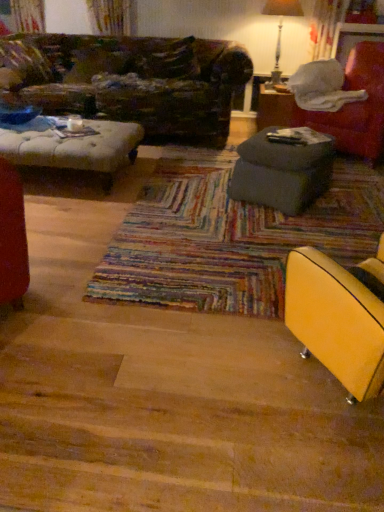
Find the location of `yellow leather chair at lower right, the 1th chair positioned from the front`. yellow leather chair at lower right, the 1th chair positioned from the front is located at coordinates (336, 321).

What do you see at coordinates (336, 321) in the screenshot? Image resolution: width=384 pixels, height=512 pixels. I see `yellow leather chair at lower right, the 2th chair positioned from the right` at bounding box center [336, 321].

The image size is (384, 512). Describe the element at coordinates (277, 108) in the screenshot. I see `matte gray ottoman at center, the 1th table when ordered from top to bottom` at that location.

What is the approximate height of metallic silver table lamp at upper right?

29.69 inches.

You are a GUI agent. You are given a task and a screenshot of the screen. Output one action in this format:
    pyautogui.click(x=<x>, y=<y>)
    Task: Click on the yellow leather chair at lower right, which ranks as the 1th chair in left-to-right order
    Image resolution: width=384 pixels, height=512 pixels.
    Given the screenshot: What is the action you would take?
    pyautogui.click(x=336, y=321)

Consider the image. Is gray fabric ottoman at right, positioned as the second table in top-to-bottom order, not within yellow leather chair at lower right, the 2th chair from the top?

Yes, gray fabric ottoman at right, positioned as the second table in top-to-bottom order, is not within yellow leather chair at lower right, the 2th chair from the top.

From their relative heights in the image, would you say gray fabric ottoman at right, which is the first table in front-to-back order, is taller or shorter than yellow leather chair at lower right, the 2th chair from the top?

gray fabric ottoman at right, which is the first table in front-to-back order, is shorter than yellow leather chair at lower right, the 2th chair from the top.

Can you confirm if gray fabric ottoman at right, which is the second table in back-to-front order, is positioned to the left of yellow leather chair at lower right, which ranks as the 1th chair in left-to-right order?

Yes.

Can you tell me how much metallic silver table lamp at upper right and gray fabric ottoman at right, which is the first table in front-to-back order, differ in facing direction?

118 degrees separate the facing orientations of metallic silver table lamp at upper right and gray fabric ottoman at right, which is the first table in front-to-back order.

From the image's perspective, between metallic silver table lamp at upper right and gray fabric ottoman at right, positioned as the second table in top-to-bottom order, who is located below?

gray fabric ottoman at right, positioned as the second table in top-to-bottom order, is shown below in the image.

Could you tell me if metallic silver table lamp at upper right is facing gray fabric ottoman at right, which is the first table in front-to-back order?

Yes, metallic silver table lamp at upper right faces towards gray fabric ottoman at right, which is the first table in front-to-back order.

Would you say metallic silver table lamp at upper right is inside or outside gray fabric ottoman at right, which is the first table in front-to-back order?

metallic silver table lamp at upper right lies outside gray fabric ottoman at right, which is the first table in front-to-back order.

Which object is wider, matte gray ottoman at center, the 1th table when ordered from top to bottom, or velvet red armchair at right, which is counted as the 2th chair, starting from the front?

Wider between the two is velvet red armchair at right, which is counted as the 2th chair, starting from the front.

Would you say matte gray ottoman at center, which ranks as the first table in back-to-front order, is inside or outside velvet red armchair at right, acting as the 1th chair starting from the back?

matte gray ottoman at center, which ranks as the first table in back-to-front order, is not inside velvet red armchair at right, acting as the 1th chair starting from the back, it's outside.

Would you consider matte gray ottoman at center, the 2th table from the bottom, to be distant from velvet red armchair at right, placed as the 1th chair when sorted from right to left?

matte gray ottoman at center, the 2th table from the bottom, is near velvet red armchair at right, placed as the 1th chair when sorted from right to left, not far away.

From the image's perspective, does matte gray ottoman at center, which ranks as the second table in front-to-back order, appear higher than velvet red armchair at right, acting as the 1th chair starting from the back?

Indeed, from the image's perspective, matte gray ottoman at center, which ranks as the second table in front-to-back order, is shown above velvet red armchair at right, acting as the 1th chair starting from the back.

Would you say velvet red armchair at right, which is counted as the 2th chair, starting from the front, is outside gray fabric ottoman at right, positioned as the second table in top-to-bottom order?

Yes, velvet red armchair at right, which is counted as the 2th chair, starting from the front, is located beyond the bounds of gray fabric ottoman at right, positioned as the second table in top-to-bottom order.

Considering the positions of point (354, 131) and point (308, 195), is point (354, 131) closer or farther from the camera than point (308, 195)?

Clearly, point (354, 131) is more distant from the camera than point (308, 195).

Locate an element on the screen. The width and height of the screenshot is (384, 512). chair behind the gray fabric ottoman at right, positioned as the first table in bottom-to-top order is located at coordinates [355, 106].

From the image's perspective, would you say velvet red armchair at right, which is the 2th chair in bottom-to-top order, is positioned over gray fabric ottoman at right, which is the second table in back-to-front order?

Yes, from the image's perspective, velvet red armchair at right, which is the 2th chair in bottom-to-top order, is above gray fabric ottoman at right, which is the second table in back-to-front order.

From a real-world perspective, is matte gray ottoman at center, the 1th table when ordered from top to bottom, positioned above or below yellow leather chair at lower right, the 2th chair from the top?

matte gray ottoman at center, the 1th table when ordered from top to bottom, is situated lower than yellow leather chair at lower right, the 2th chair from the top, in the real world.

Which of these two, matte gray ottoman at center, the 1th table when ordered from top to bottom, or yellow leather chair at lower right, the 2th chair from the top, is bigger?

yellow leather chair at lower right, the 2th chair from the top.

How far apart are matte gray ottoman at center, the 2th table from the bottom, and yellow leather chair at lower right, the 2th chair from the top?

matte gray ottoman at center, the 2th table from the bottom, and yellow leather chair at lower right, the 2th chair from the top, are 2.64 meters apart from each other.

Does matte gray ottoman at center, the 1th table when ordered from top to bottom, have a greater height compared to yellow leather chair at lower right, the 2th chair positioned from the right?

No.

How distant is velvet red armchair at right, acting as the 1th chair starting from the back, from matte gray ottoman at center, which ranks as the second table in front-to-back order?

velvet red armchair at right, acting as the 1th chair starting from the back, is 14.86 inches from matte gray ottoman at center, which ranks as the second table in front-to-back order.

From a real-world perspective, which is physically above, velvet red armchair at right, arranged as the first chair when viewed from the top, or matte gray ottoman at center, the 2th table from the bottom?

velvet red armchair at right, arranged as the first chair when viewed from the top, from a real-world perspective.

Who is more distant, velvet red armchair at right, acting as the 1th chair starting from the back, or matte gray ottoman at center, which ranks as the second table in front-to-back order?

matte gray ottoman at center, which ranks as the second table in front-to-back order, is behind.

Could you tell me if velvet red armchair at right, arranged as the first chair when viewed from the top, is facing matte gray ottoman at center, the 2th table from the bottom?

No, velvet red armchair at right, arranged as the first chair when viewed from the top, is not facing towards matte gray ottoman at center, the 2th table from the bottom.

Are yellow leather chair at lower right, acting as the second chair starting from the back, and velvet red armchair at right, arranged as the first chair when viewed from the top, making contact?

No, yellow leather chair at lower right, acting as the second chair starting from the back, is not making contact with velvet red armchair at right, arranged as the first chair when viewed from the top.

Between yellow leather chair at lower right, which ranks as the 1th chair in left-to-right order, and velvet red armchair at right, acting as the 1th chair starting from the back, which one has smaller width?

yellow leather chair at lower right, which ranks as the 1th chair in left-to-right order.

Is yellow leather chair at lower right, the 2th chair positioned from the right, turned away from velvet red armchair at right, which is the 2th chair in bottom-to-top order?

That's not correct — yellow leather chair at lower right, the 2th chair positioned from the right, is not looking away from velvet red armchair at right, which is the 2th chair in bottom-to-top order.

Can we say yellow leather chair at lower right, which ranks as the 1th chair in left-to-right order, lies outside velvet red armchair at right, which ranks as the second chair in left-to-right order?

yellow leather chair at lower right, which ranks as the 1th chair in left-to-right order, lies outside velvet red armchair at right, which ranks as the second chair in left-to-right order,'s area.

The image size is (384, 512). In the image, there is a gray fabric ottoman at right, positioned as the second table in top-to-bottom order. In order to click on chair below it (from the image's perspective) in this screenshot , I will do `click(336, 321)`.

Identify the location of table lamp behind the gray fabric ottoman at right, which is the second table in back-to-front order. (281, 26).

Based on their spatial positions, is matte gray ottoman at center, which ranks as the first table in back-to-front order, or metallic silver table lamp at upper right closer to velvet red armchair at right, which is counted as the 2th chair, starting from the front?

The object closer to velvet red armchair at right, which is counted as the 2th chair, starting from the front, is matte gray ottoman at center, which ranks as the first table in back-to-front order.

Based on the photo, looking at the image, which one is located further to gray fabric ottoman at right, positioned as the second table in top-to-bottom order, yellow leather chair at lower right, acting as the second chair starting from the back, or velvet red armchair at right, which is counted as the 2th chair, starting from the front?

Based on the image, yellow leather chair at lower right, acting as the second chair starting from the back, appears to be further to gray fabric ottoman at right, positioned as the second table in top-to-bottom order.

Considering their positions, is velvet red armchair at right, acting as the 1th chair starting from the back, positioned closer to matte gray ottoman at center, which ranks as the first table in back-to-front order, than gray fabric ottoman at right, which is the second table in back-to-front order?

velvet red armchair at right, acting as the 1th chair starting from the back.

Which object lies nearer to the anchor point matte gray ottoman at center, the 2th table from the bottom, velvet red armchair at right, which is the 2th chair in bottom-to-top order, or yellow leather chair at lower right, the 2th chair positioned from the right?

velvet red armchair at right, which is the 2th chair in bottom-to-top order, lies closer to matte gray ottoman at center, the 2th table from the bottom, than the other object.

Looking at the image, which one is located closer to matte gray ottoman at center, the 1th table when ordered from top to bottom, yellow leather chair at lower right, the 2th chair positioned from the right, or gray fabric ottoman at right, positioned as the second table in top-to-bottom order?

gray fabric ottoman at right, positioned as the second table in top-to-bottom order, is positioned closer to the anchor matte gray ottoman at center, the 1th table when ordered from top to bottom.

Which object lies nearer to the anchor point yellow leather chair at lower right, the 2th chair from the top, matte gray ottoman at center, which ranks as the second table in front-to-back order, or metallic silver table lamp at upper right?

matte gray ottoman at center, which ranks as the second table in front-to-back order, lies closer to yellow leather chair at lower right, the 2th chair from the top, than the other object.

Looking at the image, which one is located closer to metallic silver table lamp at upper right, gray fabric ottoman at right, which is the second table in back-to-front order, or velvet red armchair at right, placed as the 1th chair when sorted from right to left?

velvet red armchair at right, placed as the 1th chair when sorted from right to left.

From the image, which object appears to be nearer to gray fabric ottoman at right, positioned as the first table in bottom-to-top order, matte gray ottoman at center, the 1th table when ordered from top to bottom, or metallic silver table lamp at upper right?

matte gray ottoman at center, the 1th table when ordered from top to bottom, is closer to gray fabric ottoman at right, positioned as the first table in bottom-to-top order.

Locate an element on the screen. chair between yellow leather chair at lower right, the 1th chair positioned from the front, and matte gray ottoman at center, which ranks as the second table in front-to-back order, in the front-back direction is located at coordinates (355, 106).

I want to click on chair between yellow leather chair at lower right, acting as the second chair starting from the back, and metallic silver table lamp at upper right in the front-back direction, so click(355, 106).

Find the location of `table between yellow leather chair at lower right, the 1th chair positioned from the front, and velvet red armchair at right, arranged as the first chair when viewed from the top, along the z-axis`. table between yellow leather chair at lower right, the 1th chair positioned from the front, and velvet red armchair at right, arranged as the first chair when viewed from the top, along the z-axis is located at coordinates (283, 168).

Locate an element on the screen. The image size is (384, 512). table lamp between gray fabric ottoman at right, which is the second table in back-to-front order, and matte gray ottoman at center, the 1th table when ordered from top to bottom, along the z-axis is located at coordinates (281, 26).